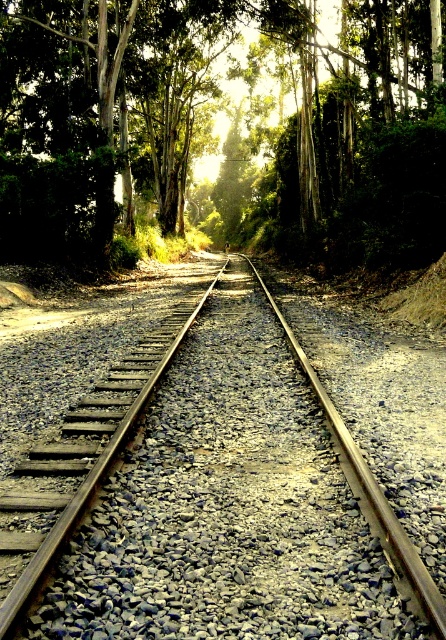
Is metal train track at center below green leafy tree at center?

Correct, metal train track at center is located below green leafy tree at center.

Who is shorter, metal train track at center or green leafy tree at center?

metal train track at center

Is point (198, 412) in front of point (189, 131)?

Yes, it is.

The image size is (446, 640). I want to click on metal train track at center, so click(x=199, y=497).